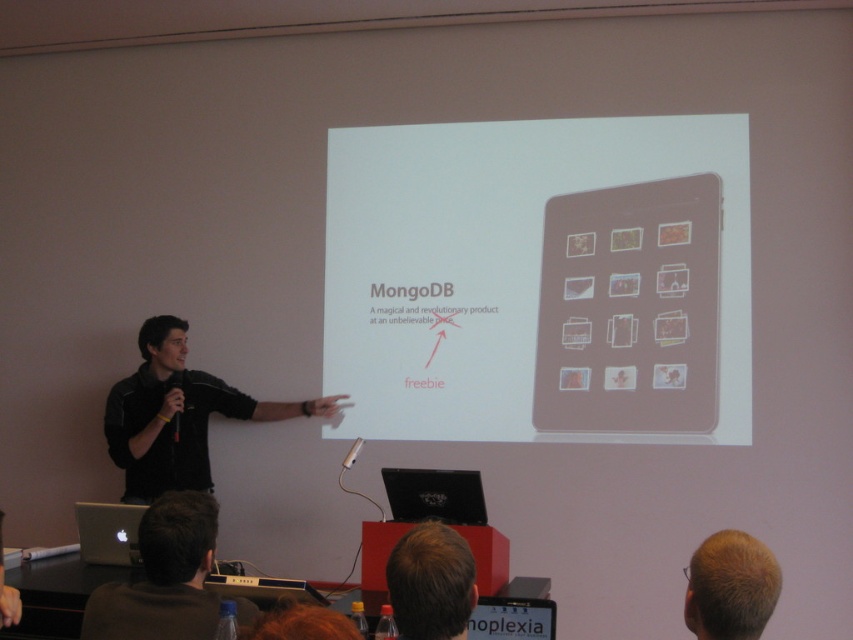
Question: Is black shirt at left above silver metallic laptop at lower left?

Choices:
 (A) no
 (B) yes

Answer: (B)

Question: Estimate the real-world distances between objects in this image. Which object is farther from the silver metallic laptop at lower left?

Choices:
 (A) matte brown tablet at upper center
 (B) matte brown tablet at center
 (C) black matte laptop at lower center
 (D) black shirt at left

Answer: (A)

Question: Which point is farther to the camera?

Choices:
 (A) blonde hair at upper center
 (B) blonde hair at upper right

Answer: (A)

Question: Can you confirm if matte brown tablet at center is positioned to the left of black matte laptop at lower center?

Choices:
 (A) no
 (B) yes

Answer: (A)

Question: Is matte brown tablet at upper center bigger than black matte laptop at lower center?

Choices:
 (A) no
 (B) yes

Answer: (B)

Question: Among these objects, which one is nearest to the camera?

Choices:
 (A) silver metallic laptop at lower left
 (B) black matte laptop at lower center
 (C) black shirt at left
 (D) blonde hair at upper right

Answer: (D)